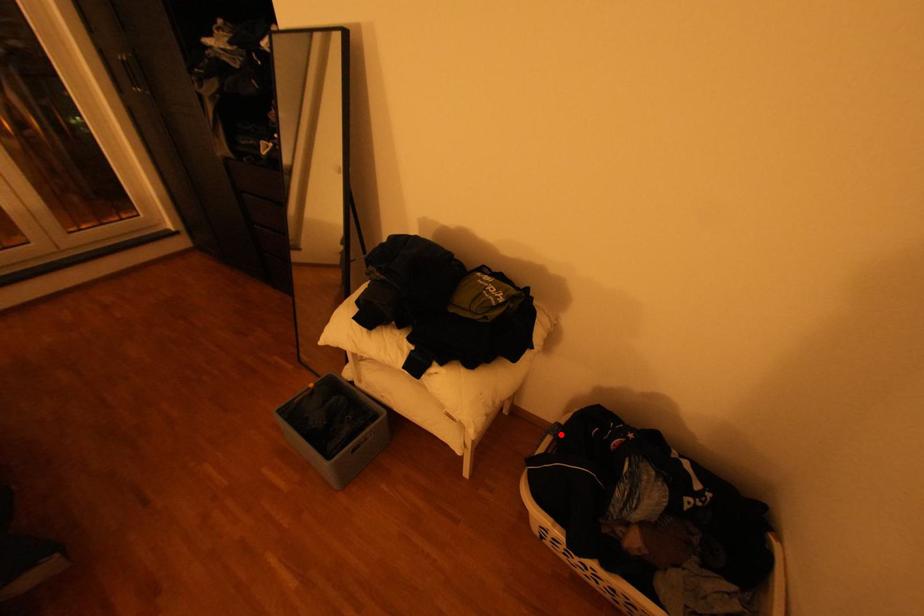
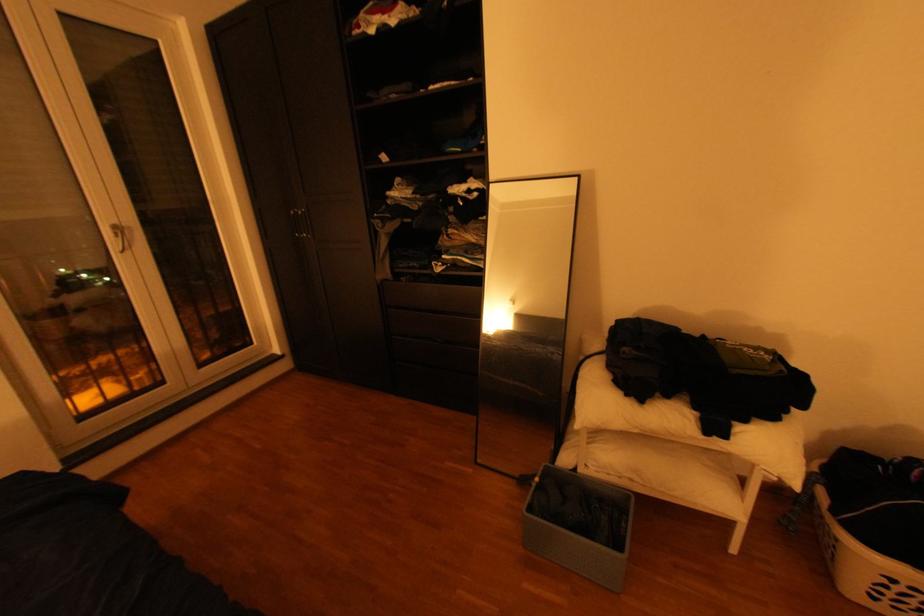
Where in the second image is the point corresponding to the highlighted location from the first image?

(830, 484)